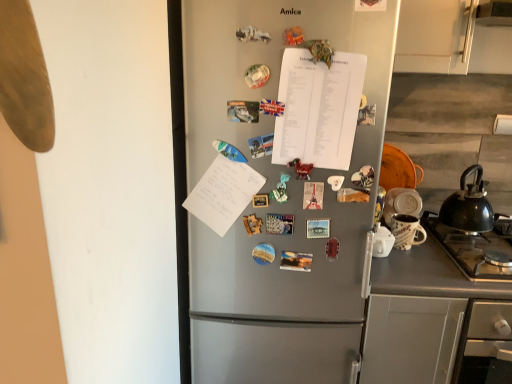
Question: Does satin silver fridge at center appear on the right side of gray matte counter at lower right?

Choices:
 (A) no
 (B) yes

Answer: (A)

Question: Are satin silver fridge at center and gray matte counter at lower right beside each other?

Choices:
 (A) no
 (B) yes

Answer: (A)

Question: From the image's perspective, is satin silver fridge at center over gray matte counter at lower right?

Choices:
 (A) yes
 (B) no

Answer: (A)

Question: From the image's perspective, is satin silver fridge at center below gray matte counter at lower right?

Choices:
 (A) no
 (B) yes

Answer: (A)

Question: Is satin silver fridge at center smaller than gray matte counter at lower right?

Choices:
 (A) no
 (B) yes

Answer: (A)

Question: Is satin silver fridge at center inside or outside of black matte kettle at right?

Choices:
 (A) outside
 (B) inside

Answer: (A)

Question: From their relative heights in the image, would you say satin silver fridge at center is taller or shorter than black matte kettle at right?

Choices:
 (A) short
 (B) tall

Answer: (B)

Question: Based on their positions, is satin silver fridge at center located to the left or right of black matte kettle at right?

Choices:
 (A) left
 (B) right

Answer: (A)

Question: In terms of size, does satin silver fridge at center appear bigger or smaller than black matte kettle at right?

Choices:
 (A) small
 (B) big

Answer: (B)

Question: From the image's perspective, is satin silver fridge at center located above or below white paper at center?

Choices:
 (A) below
 (B) above

Answer: (A)

Question: Is point (188, 3) positioned closer to the camera than point (343, 99)?

Choices:
 (A) farther
 (B) closer

Answer: (B)

Question: Is satin silver fridge at center to the left or to the right of white paper at center in the image?

Choices:
 (A) left
 (B) right

Answer: (A)

Question: Is satin silver fridge at center in front of or behind white paper at center in the image?

Choices:
 (A) behind
 (B) front

Answer: (B)

Question: Considering the positions of gray matte counter at lower right and white paper at center in the image, is gray matte counter at lower right wider or thinner than white paper at center?

Choices:
 (A) thin
 (B) wide

Answer: (B)

Question: Is gray matte counter at lower right taller or shorter than white paper at center?

Choices:
 (A) tall
 (B) short

Answer: (A)